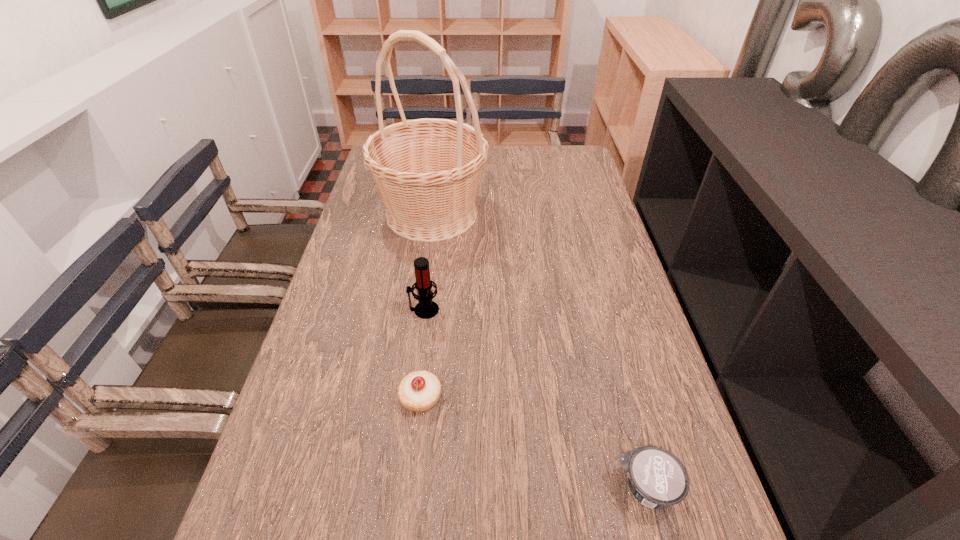
Where is `free spot located 0.210m on the left of the yogurt`? free spot located 0.210m on the left of the yogurt is located at coordinates (498, 488).

What are the coordinates of `object that is at the left edge` in the screenshot? It's located at (427, 171).

Identify the location of object situated at the right edge. The height and width of the screenshot is (540, 960). (657, 478).

In the image, there is a desktop. At what (x,y) coordinates should I click in order to perform the action: click on vacant space at the far edge. Please return your answer as a coordinate pair (x, y). This screenshot has height=540, width=960. Looking at the image, I should click on (527, 169).

Find the location of `vacant space at the left edge`. vacant space at the left edge is located at coordinates (324, 482).

In the image, there is a desktop. Where is `vacant space at the right edge`? The width and height of the screenshot is (960, 540). vacant space at the right edge is located at coordinates (628, 305).

Locate an element on the screen. This screenshot has width=960, height=540. free space at the far right corner of the desktop is located at coordinates click(x=561, y=168).

Identify the location of vacant space that's between the nearest object and the tallest object. This screenshot has height=540, width=960. (540, 351).

I want to click on free space between the nearest object and the third shortest object, so click(536, 399).

I want to click on free area in between the yogurt and the pastry, so click(x=534, y=443).